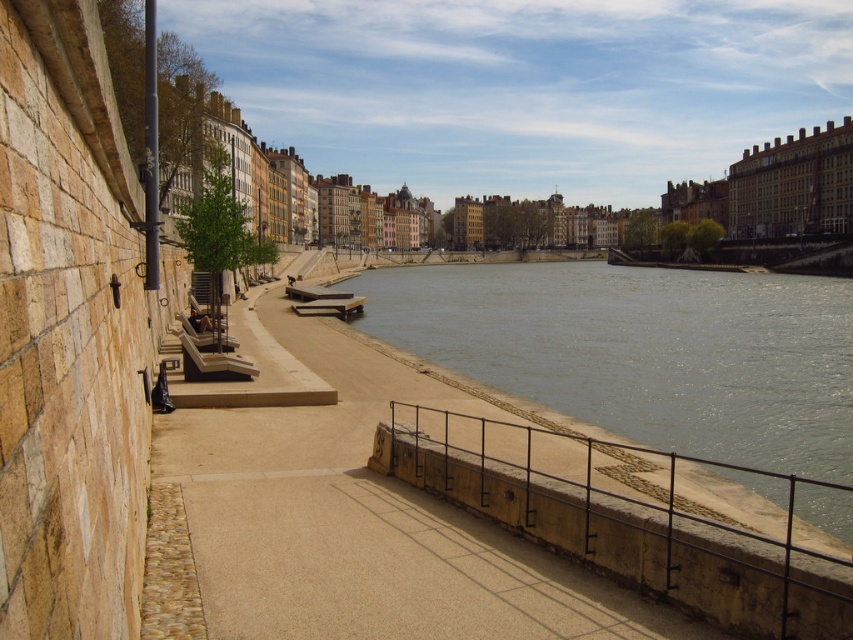
You are walking along the riverside and want to sit down on the brown wooden bench at center. From your current position on the smooth concrete path at center, which direction should you move to reach the bench?

Since the smooth concrete path at center is in front of the brown wooden bench at center, you should move backward to reach the bench.